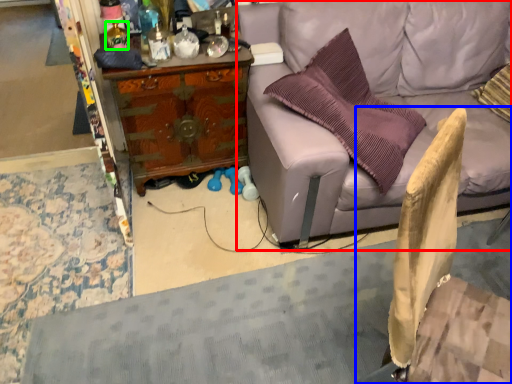
Question: Based on their relative distances, which object is farther from studio couch (highlighted by a red box)? Choose from swivel chair (highlighted by a blue box) and bottle (highlighted by a green box).

Choices:
 (A) swivel chair
 (B) bottle

Answer: (B)